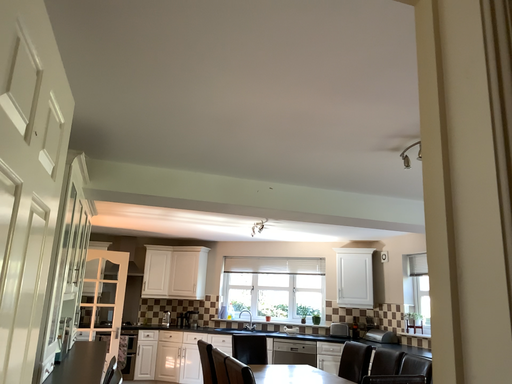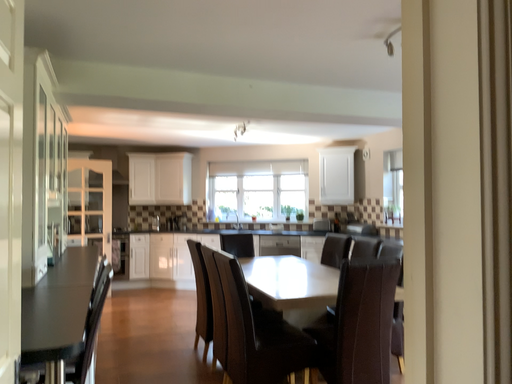
Question: How did the camera likely rotate when shooting the video?

Choices:
 (A) rotated downward
 (B) rotated upward

Answer: (A)